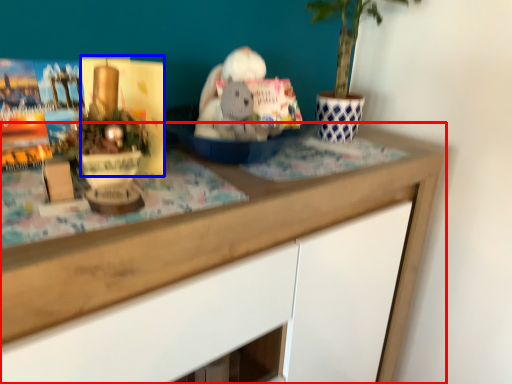
Question: Which object is further to the camera taking this photo, desk (highlighted by a red box) or paperback book (highlighted by a blue box)?

Choices:
 (A) desk
 (B) paperback book

Answer: (B)